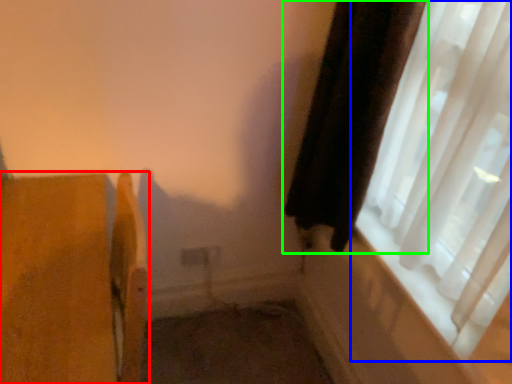
Question: Which is farther away from furniture (highlighted by a red box)? window (highlighted by a blue box) or curtain (highlighted by a green box)?

Choices:
 (A) window
 (B) curtain

Answer: (A)